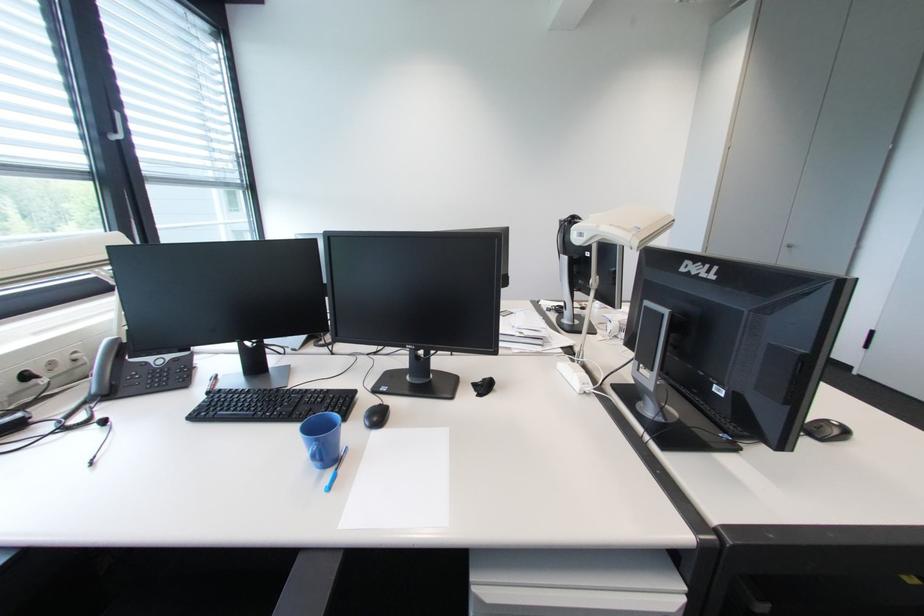
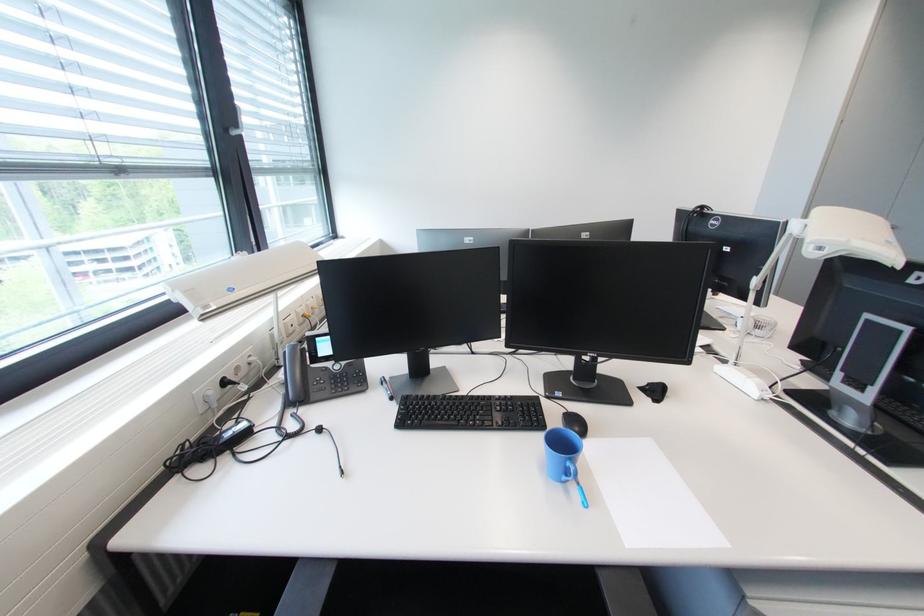
The point at (334, 392) is marked in the first image. Where is the corresponding point in the second image?

(517, 398)